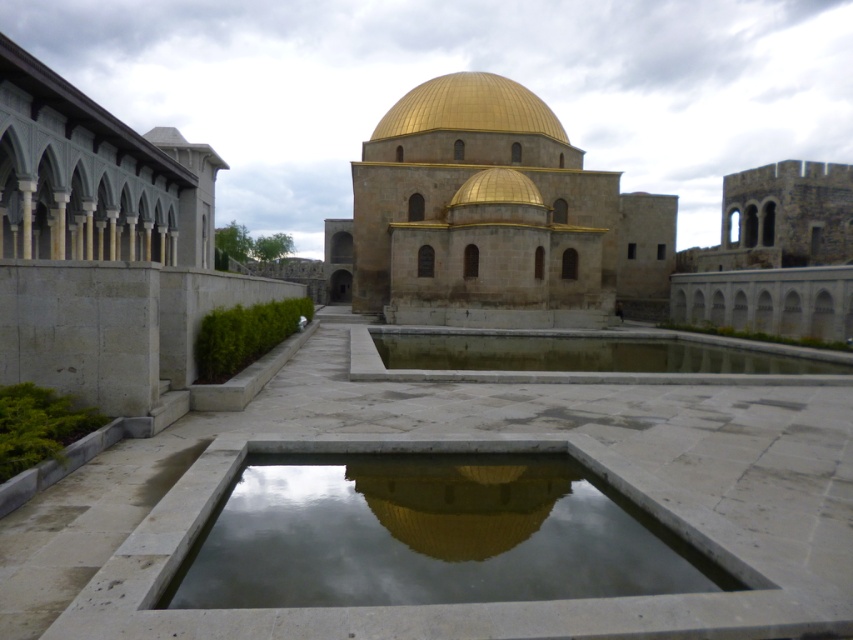
Is smooth concrete pond at center above gold stone dome at center?

Incorrect, smooth concrete pond at center is not positioned above gold stone dome at center.

Consider the image. Does smooth concrete pond at center have a lesser height compared to gold stone dome at center?

Yes.

At what (x,y) coordinates should I click in order to perform the action: click on smooth concrete pond at center. Please return your answer as a coordinate pair (x, y). Image resolution: width=853 pixels, height=640 pixels. Looking at the image, I should click on (428, 534).

Can you confirm if gold stone dome at center is smaller than gold polished dome at center?

Actually, gold stone dome at center might be larger than gold polished dome at center.

What do you see at coordinates (494, 212) in the screenshot? The image size is (853, 640). I see `gold stone dome at center` at bounding box center [494, 212].

Who is more forward, (669, 241) or (512, 113)?

Point (512, 113)

Locate an element on the screen. The width and height of the screenshot is (853, 640). gold stone dome at center is located at coordinates (494, 212).

Who is more forward, (339, 461) or (520, 104)?

Point (339, 461) is in front.

The width and height of the screenshot is (853, 640). In order to click on smooth concrete pond at center in this screenshot , I will do `click(428, 534)`.